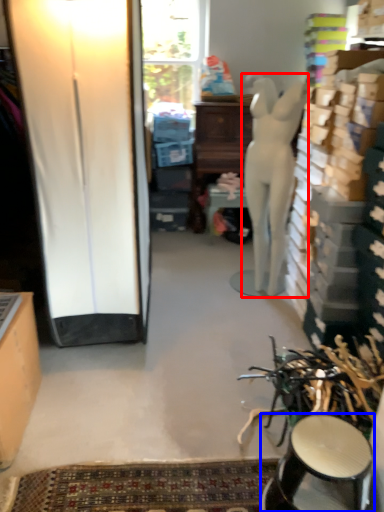
Question: Which of the following is the closest to the observer, person (highlighted by a red box) or stool (highlighted by a blue box)?

Choices:
 (A) person
 (B) stool

Answer: (B)